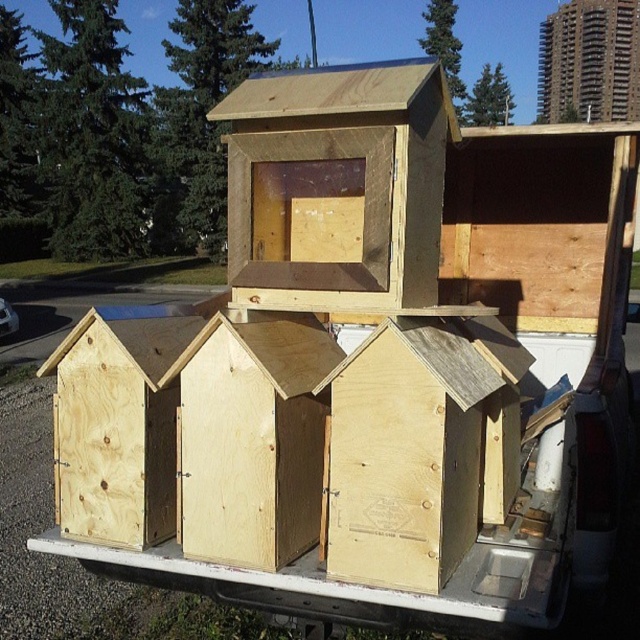
You are a delivery person who needs to load an additional small package onto the truck bed. The package must be placed between the light brown wood birdhouse at center and the plywood hut at center. Is there enough space between them to fit the package?

The light brown wood birdhouse at center is positioned on the right side of plywood hut at center, so there is space between them to place the package.